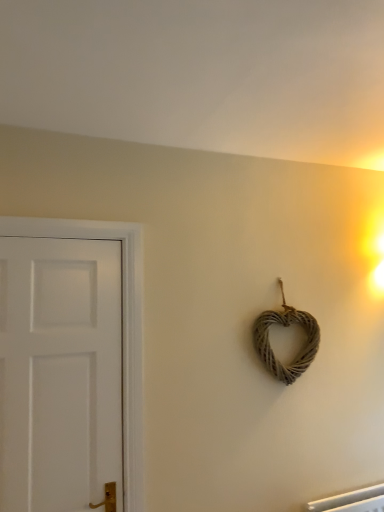
Question: Should I look upward or downward to see woven natural heart at center-right?

Choices:
 (A) up
 (B) down

Answer: (B)

Question: Is white matte door at left touching woven natural heart at center-right?

Choices:
 (A) yes
 (B) no

Answer: (B)

Question: Does white matte door at left have a lesser width compared to woven natural heart at center-right?

Choices:
 (A) no
 (B) yes

Answer: (B)

Question: Is white matte door at left oriented away from woven natural heart at center-right?

Choices:
 (A) no
 (B) yes

Answer: (A)

Question: From the image's perspective, would you say white matte door at left is positioned over woven natural heart at center-right?

Choices:
 (A) yes
 (B) no

Answer: (B)

Question: Does white matte door at left have a greater height compared to woven natural heart at center-right?

Choices:
 (A) yes
 (B) no

Answer: (A)

Question: Is white matte door at left to the left of woven natural heart at center-right from the viewer's perspective?

Choices:
 (A) no
 (B) yes

Answer: (B)

Question: From the image's perspective, would you say woven natural heart at center-right is positioned over white matte door at left?

Choices:
 (A) yes
 (B) no

Answer: (A)

Question: Can we say woven natural heart at center-right lies outside white matte door at left?

Choices:
 (A) yes
 (B) no

Answer: (A)

Question: Can you see woven natural heart at center-right touching white matte door at left?

Choices:
 (A) no
 (B) yes

Answer: (A)

Question: Is white matte door at left at the back of woven natural heart at center-right?

Choices:
 (A) no
 (B) yes

Answer: (A)

Question: Considering the relative sizes of woven natural heart at center-right and white matte door at left in the image provided, is woven natural heart at center-right taller than white matte door at left?

Choices:
 (A) no
 (B) yes

Answer: (A)

Question: Considering the relative sizes of woven natural heart at center-right and white matte door at left in the image provided, is woven natural heart at center-right shorter than white matte door at left?

Choices:
 (A) no
 (B) yes

Answer: (B)

Question: From a real-world perspective, is white matte door at left above or below woven natural heart at center-right?

Choices:
 (A) above
 (B) below

Answer: (B)